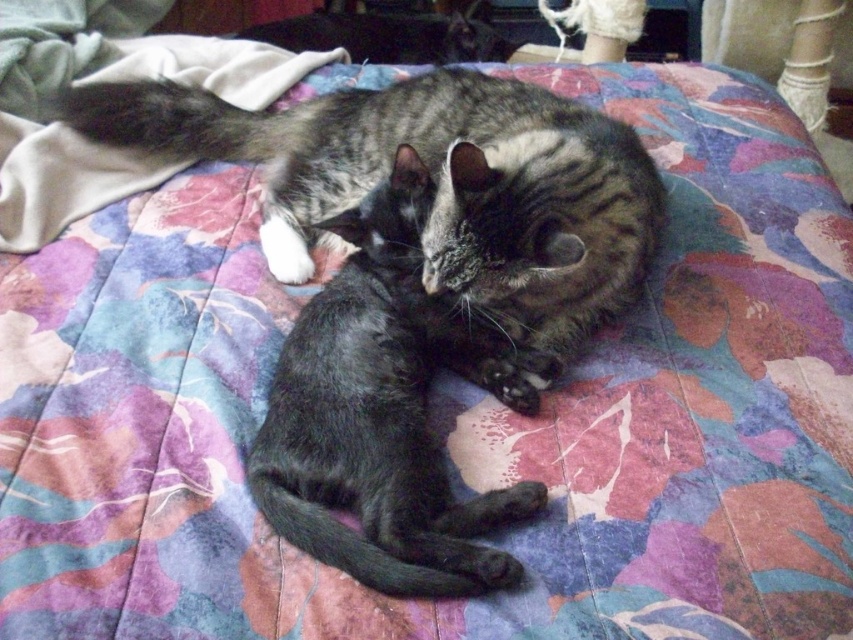
Who is positioned more to the left, tabby fur cat at center or shiny black cat at center?

Positioned to the left is tabby fur cat at center.

Is point (292, 227) closer to viewer compared to point (387, 522)?

No, it is behind (387, 522).

Image resolution: width=853 pixels, height=640 pixels. Identify the location of tabby fur cat at center. (434, 182).